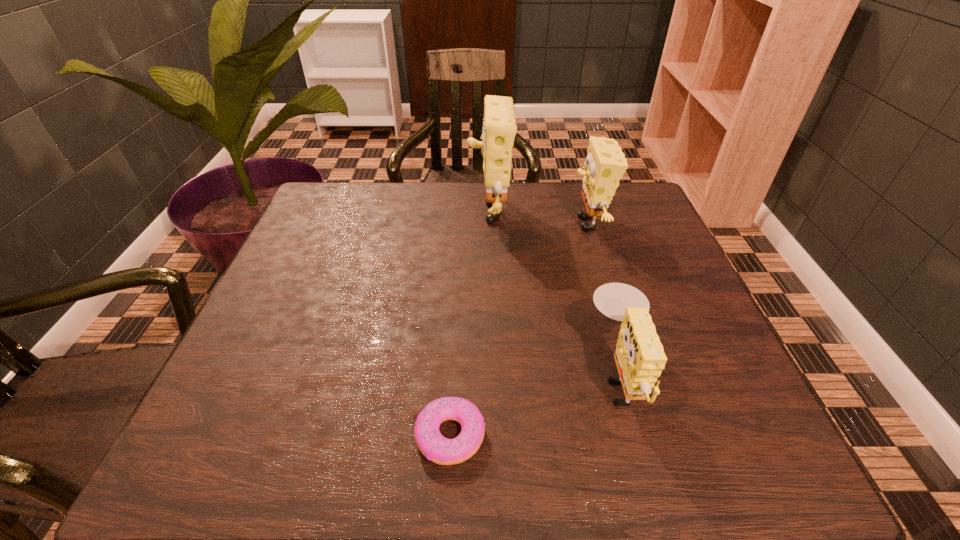
In the image, there is a desktop. At what (x,y) coordinates should I click in order to perform the action: click on vacant space at the far edge. Please return your answer as a coordinate pair (x, y). The width and height of the screenshot is (960, 540). Looking at the image, I should click on (578, 221).

Where is `free space at the near edge of the desktop`? The width and height of the screenshot is (960, 540). free space at the near edge of the desktop is located at coordinates (381, 428).

In the image, there is a desktop. Find the location of `vacant region at the left edge`. vacant region at the left edge is located at coordinates (339, 281).

In the image, there is a desktop. Where is `vacant space at the right edge`? This screenshot has height=540, width=960. vacant space at the right edge is located at coordinates (689, 281).

In the image, there is a desktop. What are the coordinates of `vacant space at the near left corner` in the screenshot? It's located at (235, 470).

Where is `vacant area that lies between the nearest sponge and the tallest object`? This screenshot has height=540, width=960. vacant area that lies between the nearest sponge and the tallest object is located at coordinates (554, 292).

You are a GUI agent. You are given a task and a screenshot of the screen. Output one action in this format:
    pyautogui.click(x=<x>, y=<y>)
    Task: Click on the vacant space in between the tallest object and the shortest sponge
    Image resolution: width=960 pixels, height=540 pixels.
    Given the screenshot: What is the action you would take?
    pyautogui.click(x=554, y=292)

Locate an element on the screen. The image size is (960, 540). unoccupied position between the nearest sponge and the tallest object is located at coordinates (554, 292).

Image resolution: width=960 pixels, height=540 pixels. In order to click on free space between the doughnut and the second tallest object in this screenshot , I will do `click(519, 329)`.

The image size is (960, 540). Identify the location of unoccupied position between the shortest object and the nearest sponge. (535, 405).